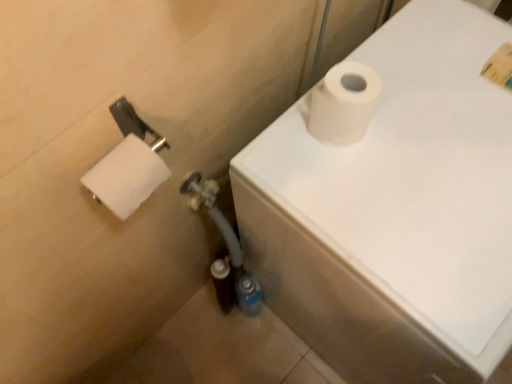
Question: Considering the relative sizes of white matte toilet paper at left, which is the 2th toilet paper from right to left, and white matte toilet paper at upper right in the image provided, is white matte toilet paper at left, which is the 2th toilet paper from right to left, thinner than white matte toilet paper at upper right?

Choices:
 (A) yes
 (B) no

Answer: (A)

Question: Does white matte toilet paper at left, which is the 2th toilet paper from right to left, have a larger size compared to white matte toilet paper at upper right?

Choices:
 (A) yes
 (B) no

Answer: (B)

Question: From a real-world perspective, does white matte toilet paper at left, which is the 2th toilet paper from right to left, sit lower than white matte toilet paper at upper right?

Choices:
 (A) no
 (B) yes

Answer: (A)

Question: Considering the relative positions of white matte toilet paper at left, which is the 2th toilet paper from right to left, and white matte toilet paper at upper right in the image provided, is white matte toilet paper at left, which is the 2th toilet paper from right to left, to the left of white matte toilet paper at upper right from the viewer's perspective?

Choices:
 (A) no
 (B) yes

Answer: (B)

Question: Is white matte toilet paper at left, arranged as the first toilet paper when viewed from the left, with white matte toilet paper at upper right?

Choices:
 (A) yes
 (B) no

Answer: (B)

Question: Is white matte toilet paper at upper right located within white matte toilet paper at left, arranged as the first toilet paper when viewed from the left?

Choices:
 (A) yes
 (B) no

Answer: (B)

Question: Are white matte toilet paper at upper right, arranged as the 2th toilet paper when viewed from the left, and white matte toilet paper at upper right making contact?

Choices:
 (A) yes
 (B) no

Answer: (B)

Question: Considering the relative sizes of white matte toilet paper at upper right, acting as the first toilet paper starting from the right, and white matte toilet paper at upper right in the image provided, is white matte toilet paper at upper right, acting as the first toilet paper starting from the right, smaller than white matte toilet paper at upper right?

Choices:
 (A) yes
 (B) no

Answer: (A)

Question: Is white matte toilet paper at upper right, arranged as the 2th toilet paper when viewed from the left, to the right of white matte toilet paper at upper right from the viewer's perspective?

Choices:
 (A) no
 (B) yes

Answer: (A)

Question: Does white matte toilet paper at upper right, arranged as the 2th toilet paper when viewed from the left, have a greater height compared to white matte toilet paper at upper right?

Choices:
 (A) yes
 (B) no

Answer: (B)

Question: Would you say white matte toilet paper at upper right is part of white matte toilet paper at upper right, acting as the first toilet paper starting from the right,'s contents?

Choices:
 (A) yes
 (B) no

Answer: (B)

Question: From a real-world perspective, is white matte toilet paper at upper right, arranged as the 2th toilet paper when viewed from the left, beneath white matte toilet paper at upper right?

Choices:
 (A) no
 (B) yes

Answer: (A)

Question: From a real-world perspective, does white matte toilet paper at upper right stand above white matte toilet paper at upper right, arranged as the 2th toilet paper when viewed from the left?

Choices:
 (A) no
 (B) yes

Answer: (A)